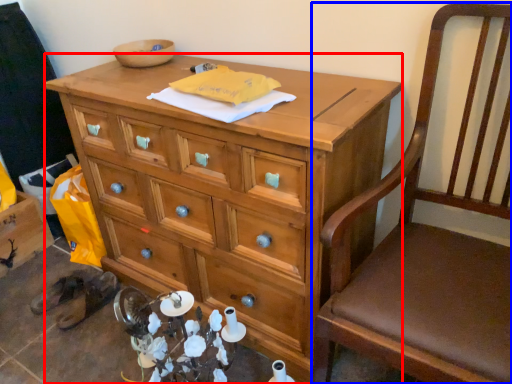
Question: Which object is closer to the camera taking this photo, desk (highlighted by a red box) or chair (highlighted by a blue box)?

Choices:
 (A) desk
 (B) chair

Answer: (B)